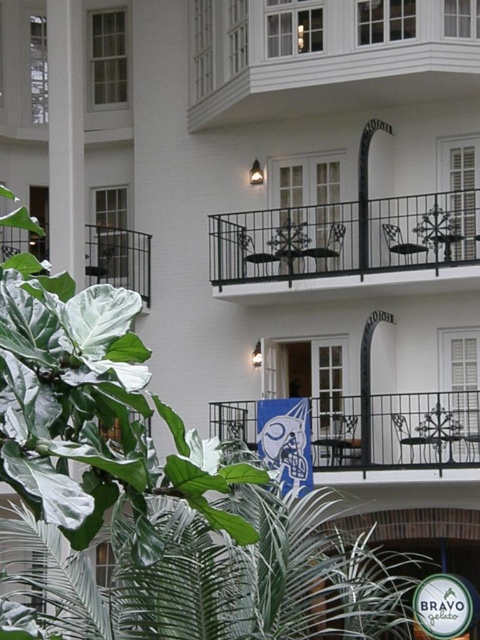
Question: Which object is closer to the camera taking this photo?

Choices:
 (A) metallic wrought iron balcony at center
 (B) white painted wood balcony at upper center

Answer: (A)

Question: Can you confirm if white painted wood balcony at upper center is positioned to the right of metallic wrought iron balcony at center?

Choices:
 (A) no
 (B) yes

Answer: (A)

Question: Does white smooth pillar at upper left appear over black wrought iron balcony at left?

Choices:
 (A) no
 (B) yes

Answer: (B)

Question: Which object is farther from the camera taking this photo?

Choices:
 (A) black wrought iron balcony at center
 (B) white smooth pillar at upper left

Answer: (B)

Question: Which object is the closest to the white painted wood balcony at upper center?

Choices:
 (A) metallic wrought iron balcony at center
 (B) black wrought iron balcony at left
 (C) black wrought iron balcony at center
 (D) white smooth pillar at upper left

Answer: (C)

Question: Does metallic wrought iron balcony at center appear on the right side of white smooth pillar at upper left?

Choices:
 (A) no
 (B) yes

Answer: (B)